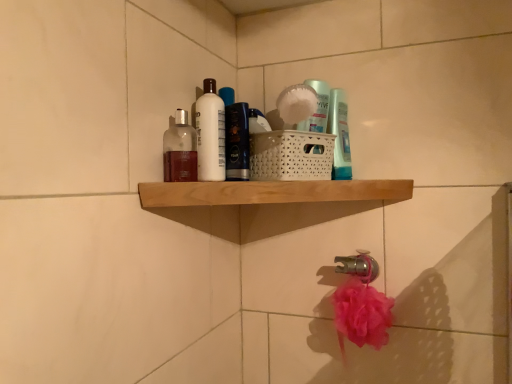
Question: Considering the relative positions of translucent glass bottle at upper center, which is counted as the third toiletry, starting from the back, and silver metallic tap at lower center in the image provided, is translucent glass bottle at upper center, which is counted as the third toiletry, starting from the back, to the left or to the right of silver metallic tap at lower center?

Choices:
 (A) right
 (B) left

Answer: (B)

Question: Based on their sizes in the image, would you say translucent glass bottle at upper center, the first toiletry in the front-to-back sequence, is bigger or smaller than silver metallic tap at lower center?

Choices:
 (A) big
 (B) small

Answer: (B)

Question: Estimate the real-world distances between objects in this image. Which object is closer to the shiny black bottle at upper center, which is the second toiletry in front-to-back order?

Choices:
 (A) silver metallic tap at lower center
 (B) wooden shelf at upper center
 (C) translucent plastic bottle at upper center, acting as the third toiletry starting from the left
 (D) translucent glass bottle at upper center, which is counted as the third toiletry, starting from the back
 (E) white glossy bottle at upper center

Answer: (E)

Question: Estimate the real-world distances between objects in this image. Which object is farther from the shiny black bottle at upper center, which is the second toiletry in front-to-back order?

Choices:
 (A) silver metallic tap at lower center
 (B) translucent glass bottle at upper center, which appears as the 1th toiletry when viewed from the left
 (C) white glossy bottle at upper center
 (D) wooden shelf at upper center
 (E) translucent plastic bottle at upper center, placed as the first toiletry when sorted from right to left

Answer: (A)